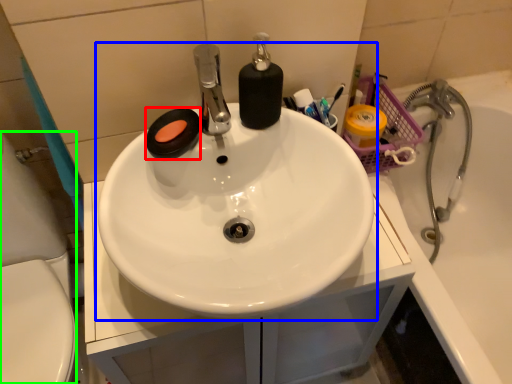
Question: Estimate the real-world distances between objects in this image. Which object is farther from soap (highlighted by a red box), sink (highlighted by a blue box) or porcelain (highlighted by a green box)?

Choices:
 (A) sink
 (B) porcelain

Answer: (B)